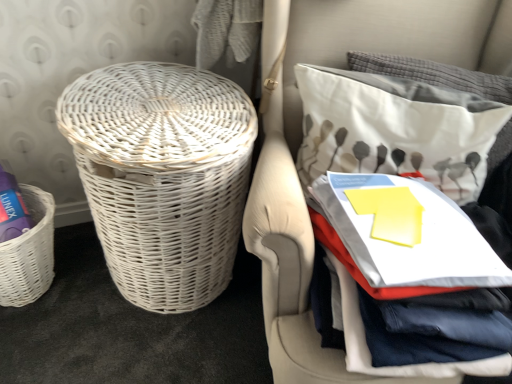
Question: Does white wicker basket at left, the first basket from the right, lie behind white wicker basket at left?

Choices:
 (A) no
 (B) yes

Answer: (B)

Question: Is white wicker basket at left, the first basket from the right, aimed at white wicker basket at left?

Choices:
 (A) no
 (B) yes

Answer: (B)

Question: Would you say white wicker basket at left is part of white wicker basket at left, the 2th basket positioned from the left,'s contents?

Choices:
 (A) yes
 (B) no

Answer: (B)

Question: Considering the relative sizes of white wicker basket at left, the 2th basket positioned from the left, and white wicker basket at left in the image provided, is white wicker basket at left, the 2th basket positioned from the left, wider than white wicker basket at left?

Choices:
 (A) yes
 (B) no

Answer: (B)

Question: Would you say white wicker basket at left, the first basket from the right, is outside white wicker basket at left?

Choices:
 (A) no
 (B) yes

Answer: (B)

Question: Is white wicker basket at left, the first basket from the right, bigger than white wicker basket at left?

Choices:
 (A) yes
 (B) no

Answer: (B)

Question: Is white fabric pillow at upper right positioned with its back to white wicker basket at left, placed as the second basket when sorted from right to left?

Choices:
 (A) no
 (B) yes

Answer: (A)

Question: From the image's perspective, is white fabric pillow at upper right on top of white wicker basket at left, which is the 1th basket from left to right?

Choices:
 (A) no
 (B) yes

Answer: (B)

Question: From a real-world perspective, is white fabric pillow at upper right physically above white wicker basket at left, placed as the second basket when sorted from right to left?

Choices:
 (A) yes
 (B) no

Answer: (A)

Question: Considering the relative sizes of white fabric pillow at upper right and white wicker basket at left, placed as the second basket when sorted from right to left, in the image provided, is white fabric pillow at upper right bigger than white wicker basket at left, placed as the second basket when sorted from right to left,?

Choices:
 (A) no
 (B) yes

Answer: (B)

Question: Is white fabric pillow at upper right located outside white wicker basket at left, placed as the second basket when sorted from right to left?

Choices:
 (A) yes
 (B) no

Answer: (A)

Question: Considering the relative sizes of white fabric pillow at upper right and white wicker basket at left, placed as the second basket when sorted from right to left, in the image provided, is white fabric pillow at upper right shorter than white wicker basket at left, placed as the second basket when sorted from right to left,?

Choices:
 (A) yes
 (B) no

Answer: (B)

Question: Does white wicker basket at left have a greater height compared to white fabric pillow at upper right?

Choices:
 (A) yes
 (B) no

Answer: (A)